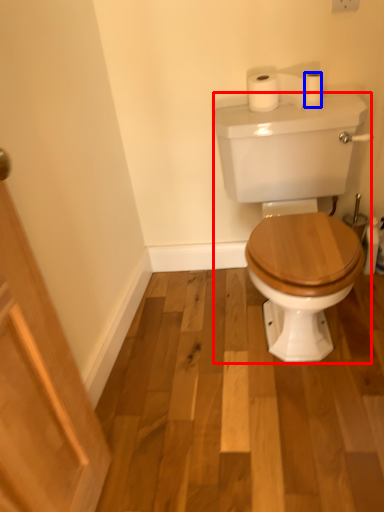
Question: Which object appears farthest to the camera in this image, porcelain (highlighted by a red box) or toilet paper (highlighted by a blue box)?

Choices:
 (A) porcelain
 (B) toilet paper

Answer: (B)